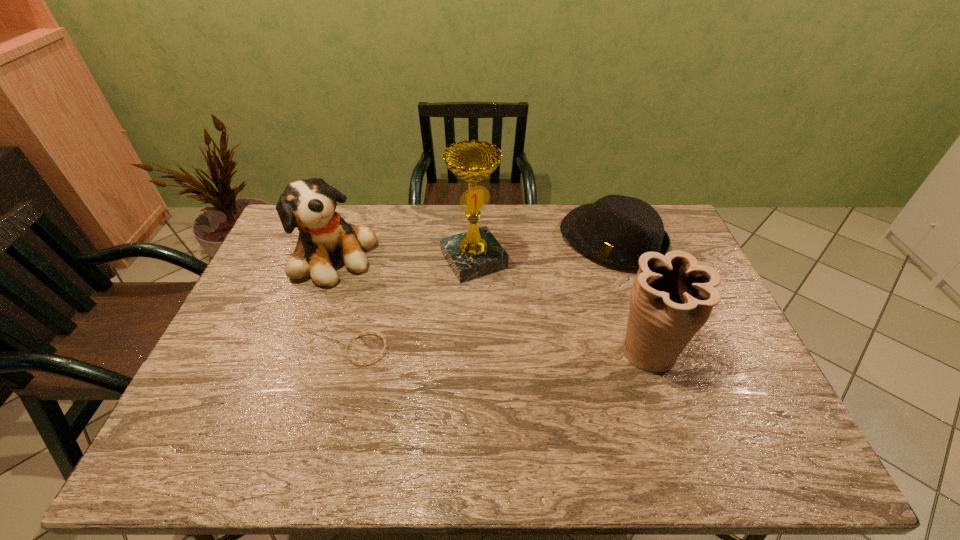
You are a GUI agent. You are given a task and a screenshot of the screen. Output one action in this format:
    pyautogui.click(x=<x>, y=<y>)
    Task: Click on the shortest object
    Image resolution: width=960 pixels, height=540 pixels.
    Given the screenshot: What is the action you would take?
    pyautogui.click(x=374, y=333)

I want to click on urn, so click(x=672, y=297).

The image size is (960, 540). In order to click on the third object from right to left in this screenshot , I will do `click(476, 253)`.

In order to click on award in this screenshot , I will do `click(476, 253)`.

What are the coordinates of `fedora` in the screenshot? It's located at (617, 230).

Find the location of `puppy`. puppy is located at coordinates (309, 205).

Locate an element on the screen. The image size is (960, 540). vacant space located on the surface of the shortest object showing star-shaped elements is located at coordinates (310, 350).

At what (x,y) coordinates should I click in order to perform the action: click on vacant space located 0.290m on the surface of the shortest object showing star-shaped elements. Please return your answer as a coordinate pair (x, y). Looking at the image, I should click on (242, 350).

I want to click on free space located on the surface of the shortest object showing star-shaped elements, so click(275, 350).

Where is `free space located on the front of the urn`? free space located on the front of the urn is located at coordinates (668, 407).